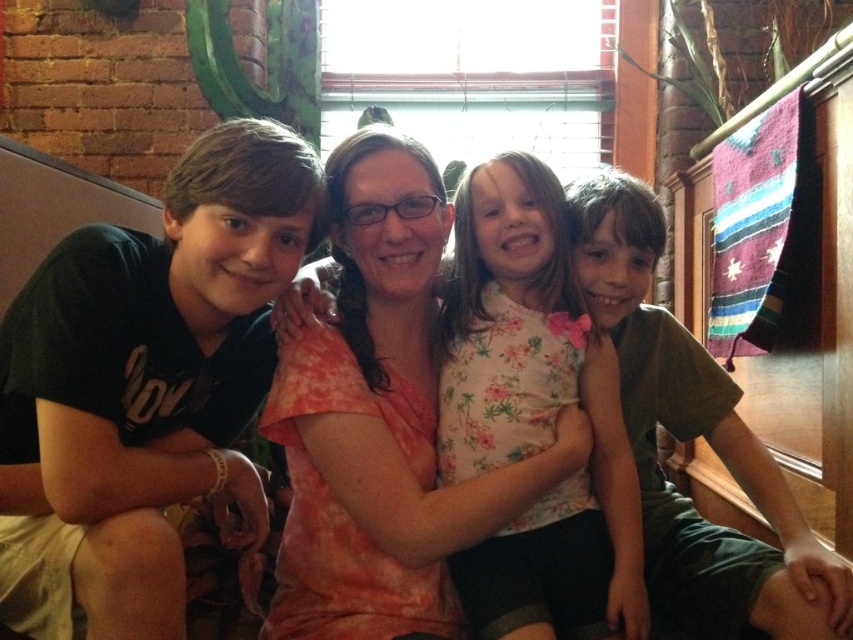
Question: Among these points, which one is farthest from the camera?

Choices:
 (A) (358, 172)
 (B) (720, 541)
 (C) (570, 330)
 (D) (88, 269)

Answer: (C)

Question: From the image, what is the correct spatial relationship of black cotton shirt at left in relation to matte green shirt at right?

Choices:
 (A) right
 (B) left

Answer: (B)

Question: Does floral fabric dress at center lie in front of matte green shirt at right?

Choices:
 (A) no
 (B) yes

Answer: (A)

Question: Can you confirm if black cotton shirt at left is positioned above floral fabric dress at center?

Choices:
 (A) yes
 (B) no

Answer: (A)

Question: Which object is the farthest from the matte green shirt at right?

Choices:
 (A) orange tie-dye shirt at center
 (B) black cotton shirt at left

Answer: (B)

Question: Which is farther from the orange tie-dye shirt at center?

Choices:
 (A) matte green shirt at right
 (B) black cotton shirt at left
 (C) floral fabric dress at center

Answer: (A)